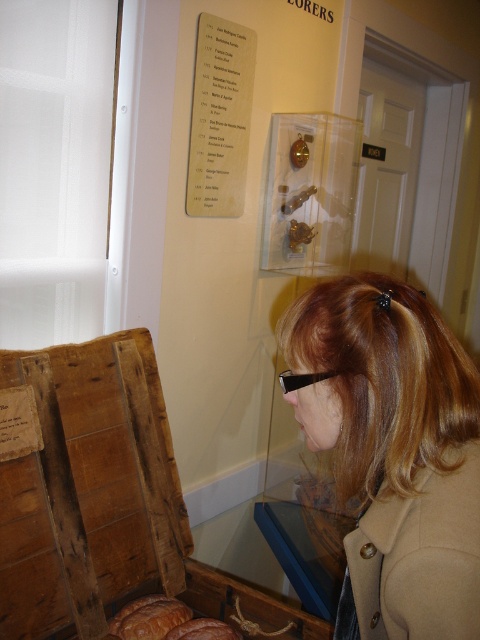
Does light brown hair at center have a greater width compared to wooden crate at lower left?

No, light brown hair at center is not wider than wooden crate at lower left.

Is point (437, 513) closer to viewer compared to point (90, 444)?

Yes, point (437, 513) is closer to viewer.

This screenshot has height=640, width=480. What are the coordinates of `light brown hair at center` in the screenshot? It's located at (393, 451).

Is brown crusty bread at lower left above black plastic goggles at center?

No.

Who is higher up, brown crusty bread at lower left or black plastic goggles at center?

black plastic goggles at center

Which is in front, point (132, 602) or point (294, 381)?

Positioned in front is point (294, 381).

You are a GUI agent. You are given a task and a screenshot of the screen. Output one action in this format:
    pyautogui.click(x=<x>, y=<y>)
    Task: Click on the brown crusty bread at lower left
    The width and height of the screenshot is (480, 640).
    Given the screenshot: What is the action you would take?
    pyautogui.click(x=166, y=621)

Does light brown hair at center have a lesser width compared to black plastic goggles at center?

In fact, light brown hair at center might be wider than black plastic goggles at center.

Is point (433, 586) behind point (309, 378)?

No.

Where is `light brown hair at center`? light brown hair at center is located at coordinates (393, 451).